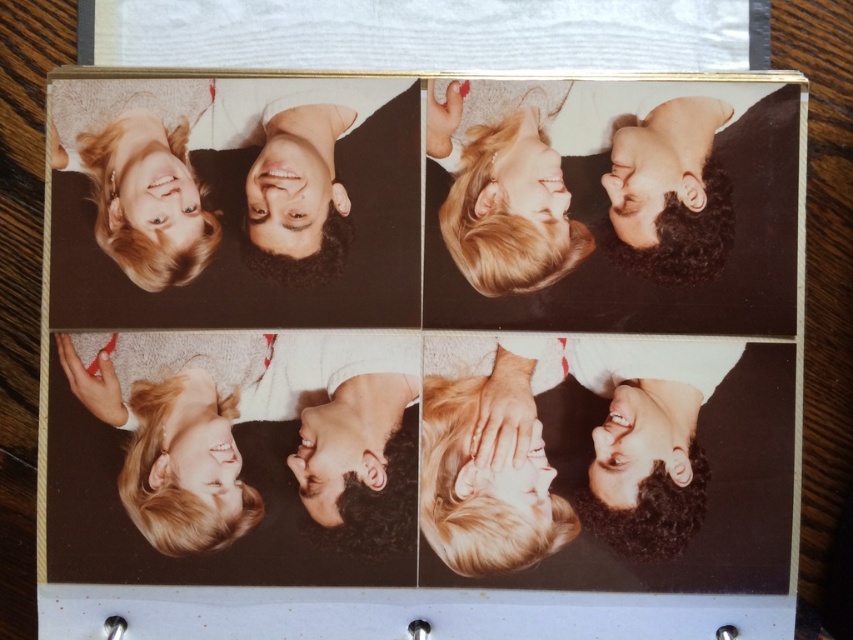
Question: Is smooth skin face at upper left bigger than curly hair at upper right?

Choices:
 (A) yes
 (B) no

Answer: (A)

Question: Observing the image, what is the correct spatial positioning of curly hair at upper right in reference to blonde hair at center?

Choices:
 (A) below
 (B) above

Answer: (B)

Question: Can you confirm if blonde hair at bottom left is positioned below blonde hair at center?

Choices:
 (A) yes
 (B) no

Answer: (B)

Question: Which point is closer to the camera?

Choices:
 (A) (712, 132)
 (B) (129, 268)
 (C) (456, 464)

Answer: (A)

Question: Considering the real-world distances, which object is farthest from the blonde hair at upper left?

Choices:
 (A) smooth skin face at bottom right
 (B) blonde hair at upper center
 (C) smooth skin face at upper left
 (D) curly hair at upper right

Answer: (D)

Question: Among these objects, which one is nearest to the camera?

Choices:
 (A) blonde hair at bottom left
 (B) smooth skin face at bottom right
 (C) curly hair at upper right
 (D) blonde hair at center

Answer: (A)